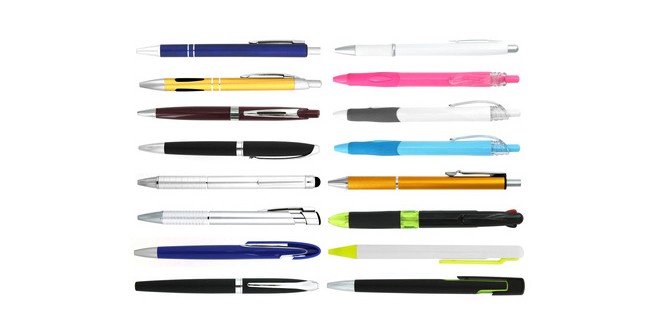
Image resolution: width=660 pixels, height=330 pixels. Identify the location of pens in left column. (282, 288), (279, 251), (276, 216), (274, 190), (268, 147), (268, 118), (266, 88), (266, 43).